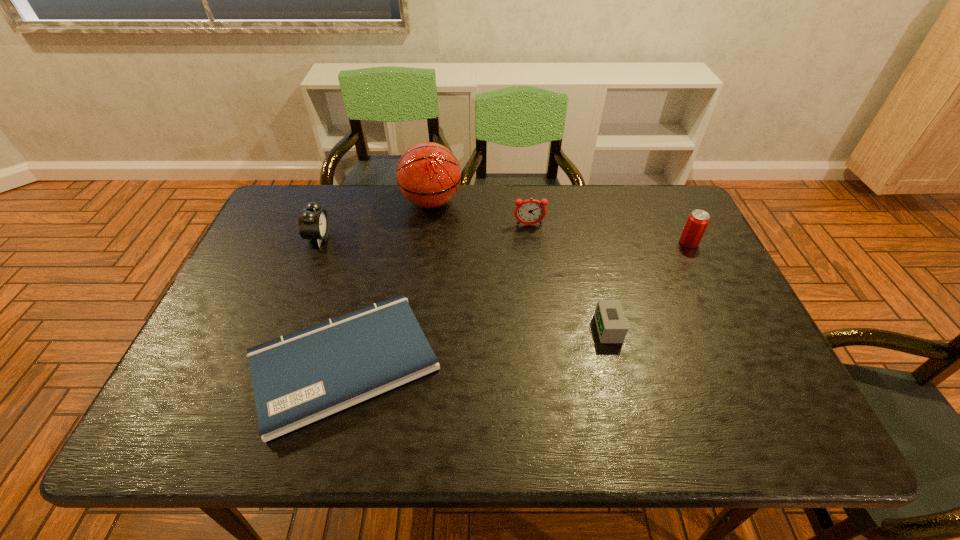
Locate an element on the screen. Image resolution: width=960 pixels, height=540 pixels. the farthest object is located at coordinates (428, 174).

Locate an element on the screen. The height and width of the screenshot is (540, 960). basketball is located at coordinates (428, 174).

Locate an element on the screen. the leftmost alarm clock is located at coordinates (313, 223).

The height and width of the screenshot is (540, 960). I want to click on the rightmost object, so click(x=697, y=222).

At what (x,y) coordinates should I click in order to perform the action: click on the third object from right to left. Please return your answer as a coordinate pair (x, y). This screenshot has width=960, height=540. Looking at the image, I should click on (531, 211).

Find the location of `the fifth tallest object`. the fifth tallest object is located at coordinates (612, 327).

Locate an element on the screen. the nearest alarm clock is located at coordinates (612, 327).

You are a GUI agent. You are given a task and a screenshot of the screen. Output one action in this format:
    pyautogui.click(x=<x>, y=<y>)
    Task: Click on the shortest object
    This screenshot has height=540, width=960.
    Given the screenshot: What is the action you would take?
    pos(302,377)

Locate an element on the screen. Image resolution: width=960 pixels, height=540 pixels. vacant region located 0.240m on the side with spill of the basketball is located at coordinates (536, 202).

The width and height of the screenshot is (960, 540). I want to click on free space located on the front side of the leftmost alarm clock, so click(x=449, y=238).